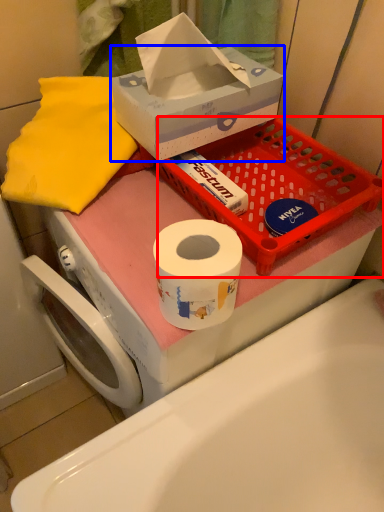
Question: Which of the following is the farthest to the observer, basket (highlighted by a red box) or box (highlighted by a blue box)?

Choices:
 (A) basket
 (B) box

Answer: (A)